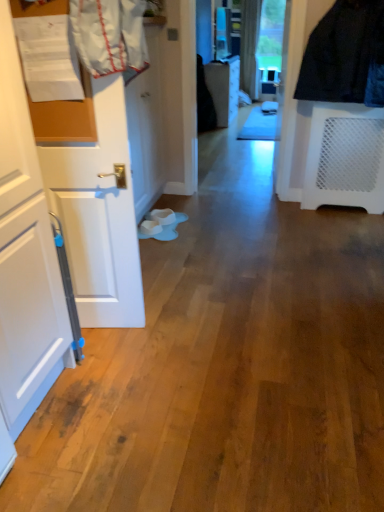
Find the location of a particular element. Image resolution: width=384 pixels, height=512 pixels. free location in front of white matte door at left, the second door viewed from the back is located at coordinates point(111,361).